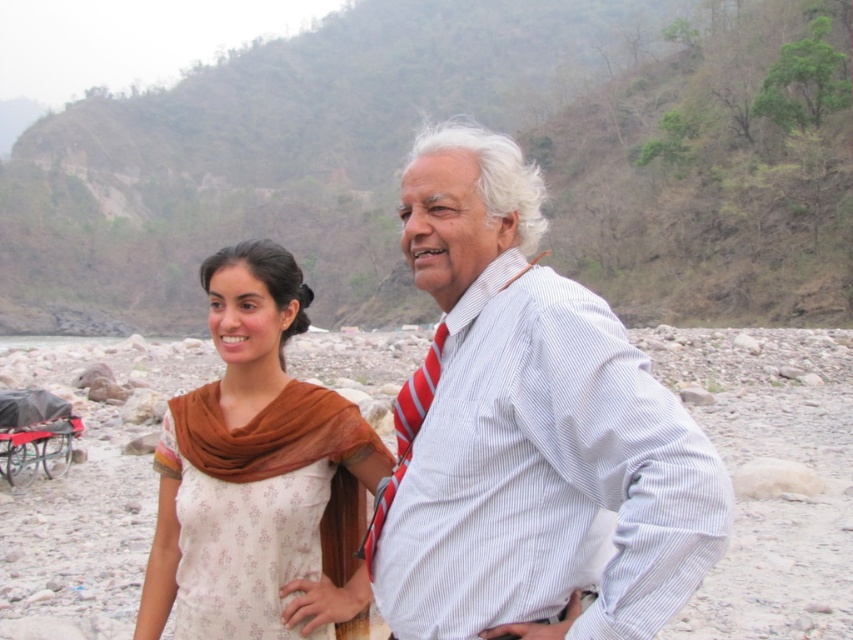
Question: Which is farther from the matte orange scarf at center?

Choices:
 (A) red striped tie at center
 (B) white striped shirt at center

Answer: (A)

Question: Which object is positioned farthest from the red striped tie at center?

Choices:
 (A) matte orange scarf at center
 (B) white striped shirt at center

Answer: (B)

Question: Can you confirm if white striped shirt at center is positioned to the right of red striped tie at center?

Choices:
 (A) yes
 (B) no

Answer: (A)

Question: Is the position of white striped shirt at center less distant than that of red striped tie at center?

Choices:
 (A) yes
 (B) no

Answer: (A)

Question: Can you confirm if matte orange scarf at center is positioned to the left of red striped tie at center?

Choices:
 (A) no
 (B) yes

Answer: (B)

Question: Which of these objects is positioned closest to the white striped shirt at center?

Choices:
 (A) red striped tie at center
 (B) matte orange scarf at center

Answer: (B)